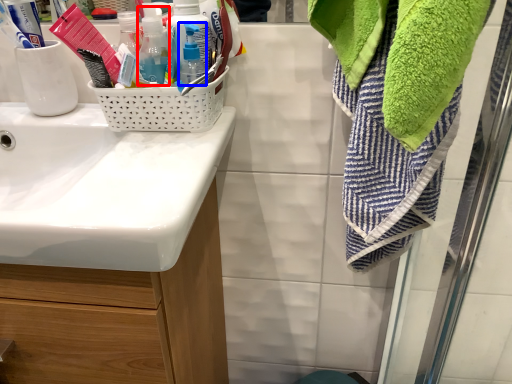
Question: Among these objects, which one is nearest to the camera, bottle (highlighted by a red box) or bottle (highlighted by a blue box)?

Choices:
 (A) bottle
 (B) bottle

Answer: (A)